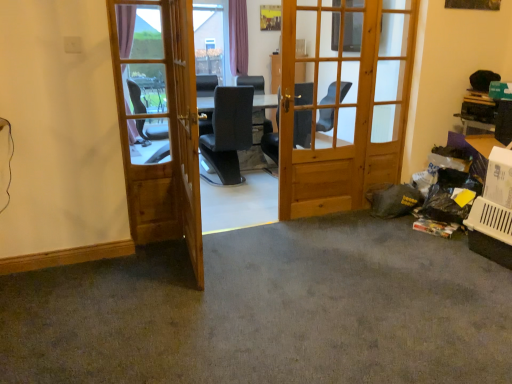
Question: From a real-world perspective, is gray carpet at lower right physically located above or below light brown wooden screen door at center?

Choices:
 (A) above
 (B) below

Answer: (B)

Question: From the image's perspective, relative to light brown wooden screen door at center, is gray carpet at lower right above or below?

Choices:
 (A) above
 (B) below

Answer: (B)

Question: Which object is positioned farthest from the wooden door at center, the second door when ordered from left to right?

Choices:
 (A) light brown wooden screen door at center
 (B) wooden door at left, the second door positioned from the right
 (C) gray carpet at lower right

Answer: (C)

Question: Estimate the real-world distances between objects in this image. Which object is closer to the wooden door at left, placed as the 1th door when sorted from left to right?

Choices:
 (A) wooden door at center, which ranks as the 1th door in right-to-left order
 (B) light brown wooden screen door at center
 (C) gray carpet at lower right

Answer: (B)